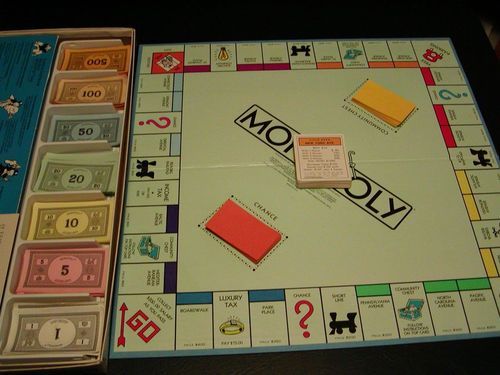
Identify the location of piles of monopoly money. (38, 322), (54, 282), (69, 217), (75, 169), (79, 126), (87, 88), (92, 56).